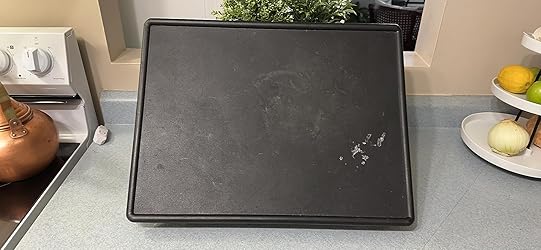
Identify the location of kettle. (26, 154).